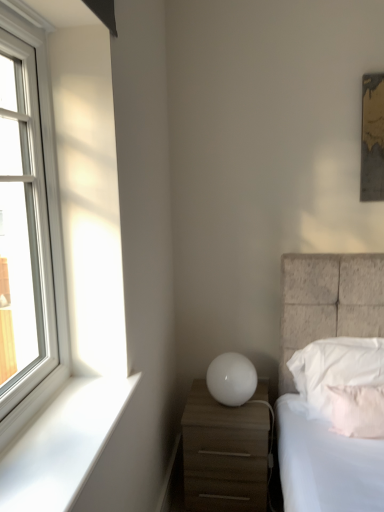
Where is `free space below white glossy sphere at center (from a real-world perspective)`? The height and width of the screenshot is (512, 384). free space below white glossy sphere at center (from a real-world perspective) is located at coordinates (231, 407).